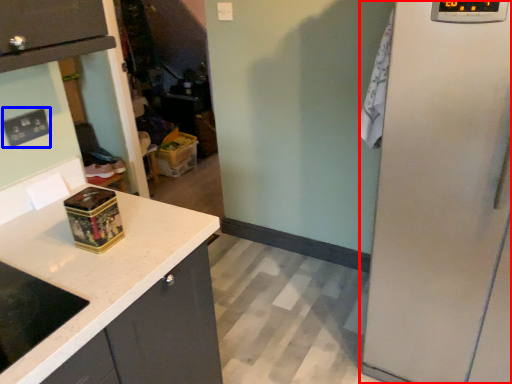
Question: Which of the following is the closest to the observer, appliance (highlighted by a red box) or electric outlet (highlighted by a blue box)?

Choices:
 (A) appliance
 (B) electric outlet

Answer: (A)